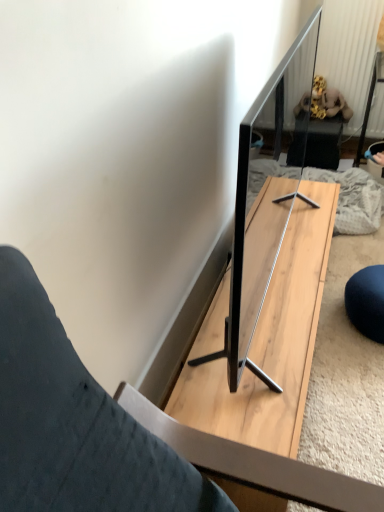
Where is `velvet plush toy at upper right`? velvet plush toy at upper right is located at coordinates (319, 128).

Image resolution: width=384 pixels, height=512 pixels. What do you see at coordinates (319, 128) in the screenshot?
I see `velvet plush toy at upper right` at bounding box center [319, 128].

What is the approximate width of velvet plush toy at upper right?

The width of velvet plush toy at upper right is 32.49 centimeters.

Image resolution: width=384 pixels, height=512 pixels. What do you see at coordinates (270, 343) in the screenshot? I see `light wood table at center` at bounding box center [270, 343].

At what (x,y) coordinates should I click in order to perform the action: click on light wood table at center. Please return your answer as a coordinate pair (x, y). The width and height of the screenshot is (384, 512). Looking at the image, I should click on (270, 343).

Identify the location of velvet plush toy at upper right. Image resolution: width=384 pixels, height=512 pixels. (319, 128).

Visually, is velvet plush toy at upper right positioned to the left or to the right of light wood table at center?

velvet plush toy at upper right is positioned on light wood table at center's right side.

Is velvet plush toy at upper right in front of light wood table at center?

That is False.

In the scene shown: Which is nearer, (305, 158) or (254, 503)?

Point (305, 158) is farther from the camera than point (254, 503).

From the image's perspective, is velvet plush toy at upper right located above light wood table at center?

Indeed, from the image's perspective, velvet plush toy at upper right is shown above light wood table at center.

From a real-world perspective, is velvet plush toy at upper right below light wood table at center?

No, from a real-world perspective, velvet plush toy at upper right is not below light wood table at center.

Considering the relative sizes of velvet plush toy at upper right and light wood table at center in the image provided, is velvet plush toy at upper right wider than light wood table at center?

No, velvet plush toy at upper right is not wider than light wood table at center.

Consider the image. Between velvet plush toy at upper right and light wood table at center, which one has more height?

With more height is velvet plush toy at upper right.

Between velvet plush toy at upper right and light wood table at center, which one has larger size?

light wood table at center.

Can light wood table at center be found inside velvet plush toy at upper right?

That's incorrect, light wood table at center is not inside velvet plush toy at upper right.

Are velvet plush toy at upper right and light wood table at center far apart?

Result: Absolutely, velvet plush toy at upper right is distant from light wood table at center.

Is velvet plush toy at upper right oriented away from light wood table at center?

No, velvet plush toy at upper right is not facing the opposite direction of light wood table at center.

What's the angular difference between velvet plush toy at upper right and light wood table at center's facing directions?

There is a 0.328-degree angle between the facing directions of velvet plush toy at upper right and light wood table at center.

How much distance is there between velvet plush toy at upper right and light wood table at center?

They are 1.01 meters apart.

What are the coordinates of `person above the light wood table at center (from the image's perspective)` in the screenshot? It's located at (319, 128).

Considering the positions of objects light wood table at center and velvet plush toy at upper right in the image provided, who is more to the left, light wood table at center or velvet plush toy at upper right?

light wood table at center is more to the left.

Is light wood table at center positioned in front of velvet plush toy at upper right?

Yes, light wood table at center is closer to the camera.

Is point (256, 379) closer to viewer compared to point (328, 134)?

Yes, it is.

From the image's perspective, which one is positioned higher, light wood table at center or velvet plush toy at upper right?

velvet plush toy at upper right appears higher in the image.

Consider the image. From a real-world perspective, is light wood table at center below velvet plush toy at upper right?

Yes.

Considering the relative sizes of light wood table at center and velvet plush toy at upper right in the image provided, is light wood table at center thinner than velvet plush toy at upper right?

In fact, light wood table at center might be wider than velvet plush toy at upper right.

From their relative heights in the image, would you say light wood table at center is taller or shorter than velvet plush toy at upper right?

Considering their sizes, light wood table at center has less height than velvet plush toy at upper right.

Which of these two, light wood table at center or velvet plush toy at upper right, is bigger?

Bigger between the two is light wood table at center.

Can we say light wood table at center lies outside velvet plush toy at upper right?

Yes.

Would you consider light wood table at center to be distant from velvet plush toy at upper right?

Yes, light wood table at center and velvet plush toy at upper right are quite far apart.

Is light wood table at center oriented towards velvet plush toy at upper right?

No, light wood table at center does not turn towards velvet plush toy at upper right.

This screenshot has height=512, width=384. In order to click on person behind the light wood table at center in this screenshot , I will do `click(319, 128)`.

The height and width of the screenshot is (512, 384). Identify the location of table located underneath the velvet plush toy at upper right (from a real-world perspective). (270, 343).

Where is `person located on the right of light wood table at center`? Image resolution: width=384 pixels, height=512 pixels. person located on the right of light wood table at center is located at coordinates (319, 128).